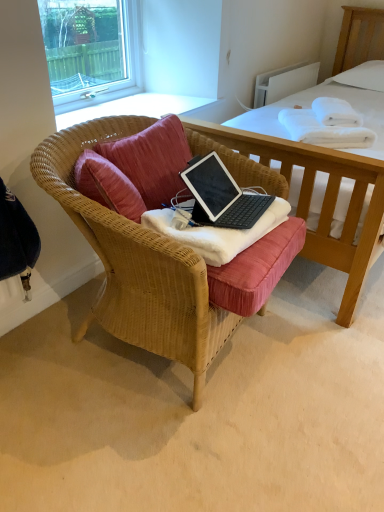
Question: Is clear glass window at upper left wider than white soft towel at upper right, the 1th blanket when ordered from right to left?

Choices:
 (A) yes
 (B) no

Answer: (B)

Question: From the image's perspective, is clear glass window at upper left on white soft towel at upper right, the 1th blanket when ordered from right to left?

Choices:
 (A) yes
 (B) no

Answer: (A)

Question: From the image's perspective, is clear glass window at upper left located beneath white soft towel at upper right, which ranks as the 2th blanket in front-to-back order?

Choices:
 (A) yes
 (B) no

Answer: (B)

Question: Would you say clear glass window at upper left is a long distance from white soft towel at upper right, the 1th blanket from the top?

Choices:
 (A) yes
 (B) no

Answer: (A)

Question: Does clear glass window at upper left have a larger size compared to white soft towel at upper right, positioned as the second blanket in bottom-to-top order?

Choices:
 (A) yes
 (B) no

Answer: (A)

Question: Is clear glass window at upper left aimed at white soft towel at upper right, positioned as the second blanket in bottom-to-top order?

Choices:
 (A) no
 (B) yes

Answer: (B)

Question: Is woven wood chair at center aimed at white soft blanket at center, which is the 2th blanket in right-to-left order?

Choices:
 (A) yes
 (B) no

Answer: (A)

Question: Does woven wood chair at center have a larger size compared to white soft blanket at center, which ranks as the first blanket in front-to-back order?

Choices:
 (A) yes
 (B) no

Answer: (A)

Question: Does woven wood chair at center have a lesser width compared to white soft blanket at center, which ranks as the first blanket in front-to-back order?

Choices:
 (A) yes
 (B) no

Answer: (B)

Question: Considering the relative sizes of woven wood chair at center and white soft blanket at center, which ranks as the first blanket in front-to-back order, in the image provided, is woven wood chair at center smaller than white soft blanket at center, which ranks as the first blanket in front-to-back order,?

Choices:
 (A) no
 (B) yes

Answer: (A)

Question: Is woven wood chair at center closer to camera compared to white soft blanket at center, which is counted as the second blanket, starting from the back?

Choices:
 (A) yes
 (B) no

Answer: (A)

Question: Would you say woven wood chair at center is outside white soft blanket at center, the first blanket in the left-to-right sequence?

Choices:
 (A) no
 (B) yes

Answer: (B)

Question: From the image's perspective, is white soft blanket at center, which is the 2th blanket in right-to-left order, on white soft towel at upper right, which ranks as the 2th blanket in front-to-back order?

Choices:
 (A) yes
 (B) no

Answer: (B)